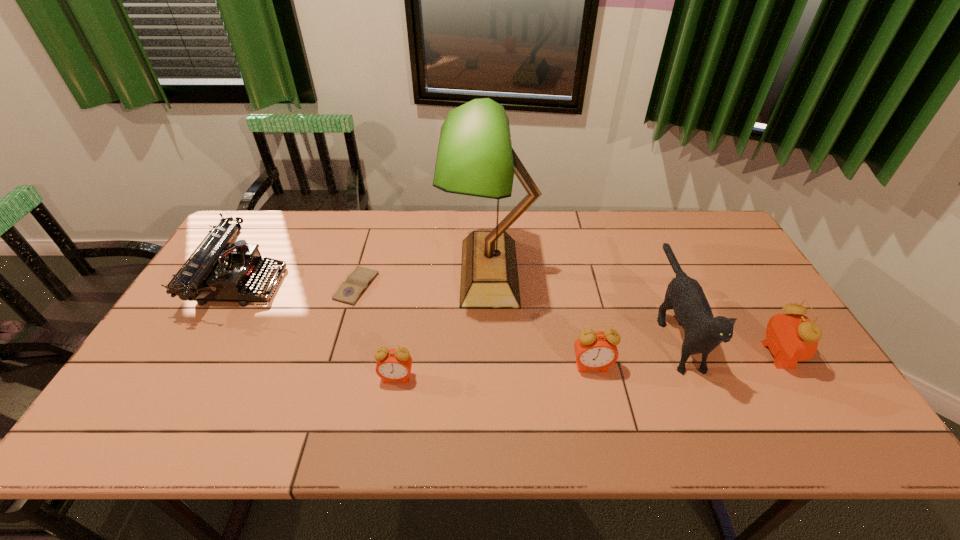
Locate an element on the screen. vacant area between the second shortest alarm clock and the sixth shortest object is located at coordinates (633, 346).

Identify the location of free space between the fifth object from right to left and the fourth object from left to right. (444, 325).

Image resolution: width=960 pixels, height=540 pixels. In order to click on free spot between the second tallest object and the tallest object in this screenshot , I will do `click(582, 299)`.

The image size is (960, 540). Find the location of `vacant space that's between the typewriter and the second object from right to left`. vacant space that's between the typewriter and the second object from right to left is located at coordinates (458, 305).

Locate an element on the screen. The width and height of the screenshot is (960, 540). vacant area that lies between the diary and the table lamp is located at coordinates (423, 279).

What are the coordinates of `vacant region between the rightmost object and the leftmost object` in the screenshot? It's located at (510, 319).

Where is `empty location between the typewriter and the third object from left to right`? This screenshot has height=540, width=960. empty location between the typewriter and the third object from left to right is located at coordinates (319, 330).

The width and height of the screenshot is (960, 540). Identify the location of the third closest object relative to the typewriter. (475, 157).

Point out which object is positioned as the fifth nearest to the second shortest alarm clock. Please provide its 2D coordinates. Your answer should be formatted as a tuple, i.e. [(x, y)], where the tuple contains the x and y coordinates of a point satisfying the conditions above.

[(349, 292)]

Locate an element on the screen. alarm clock that is the second closest to the fifth object from left to right is located at coordinates (793, 337).